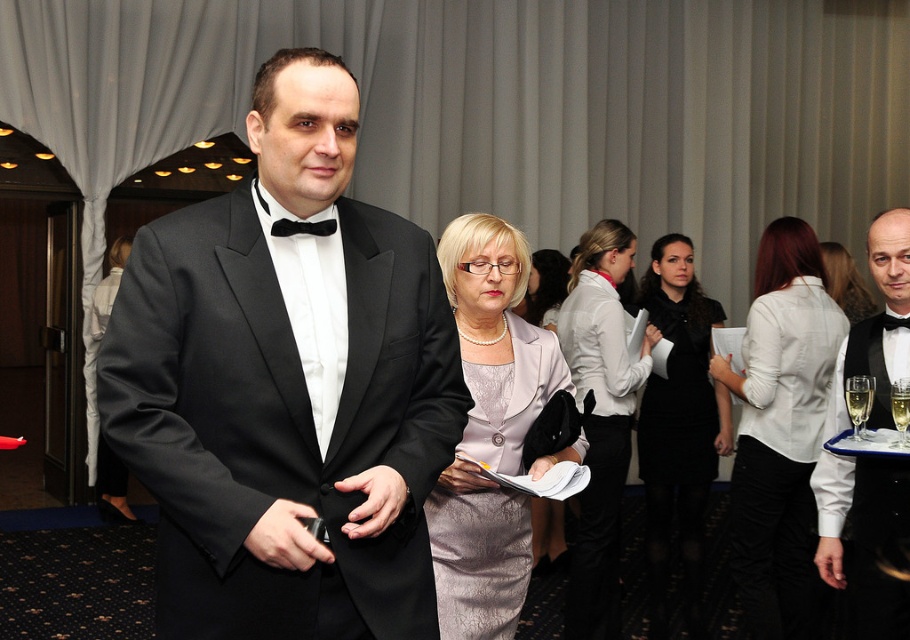
Based on the photo, does black satin dress at center have a greater width compared to black satin bow tie at upper right?

Yes, black satin dress at center is wider than black satin bow tie at upper right.

Can you confirm if black satin dress at center is positioned above black satin bow tie at upper right?

No.

This screenshot has width=910, height=640. Describe the element at coordinates (679, 428) in the screenshot. I see `black satin dress at center` at that location.

In order to click on black satin dress at center in this screenshot , I will do `click(679, 428)`.

Who is positioned more to the right, matte gray dress at center or silvery metallic dress at center?

silvery metallic dress at center is more to the right.

Is matte gray dress at center bigger than silvery metallic dress at center?

Actually, matte gray dress at center might be smaller than silvery metallic dress at center.

Is point (671, 420) positioned before point (828, 243)?

Yes, point (671, 420) is closer to viewer.

You are a GUI agent. You are given a task and a screenshot of the screen. Output one action in this format:
    pyautogui.click(x=<x>, y=<y>)
    Task: Click on the matte gray dress at center
    
    Given the screenshot: What is the action you would take?
    pyautogui.click(x=795, y=396)

Which is above, black satin tuxedo at center or silvery metallic dress at center?

silvery metallic dress at center

Who is more distant from viewer, (187, 618) or (847, 308)?

The point (847, 308) is behind.

Where is `black satin tuxedo at center`? The width and height of the screenshot is (910, 640). black satin tuxedo at center is located at coordinates (287, 387).